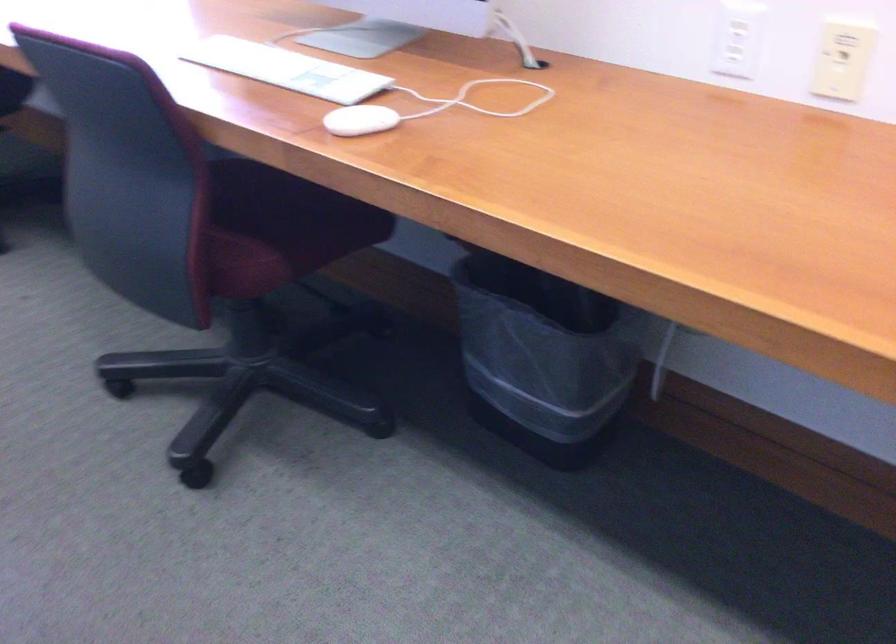
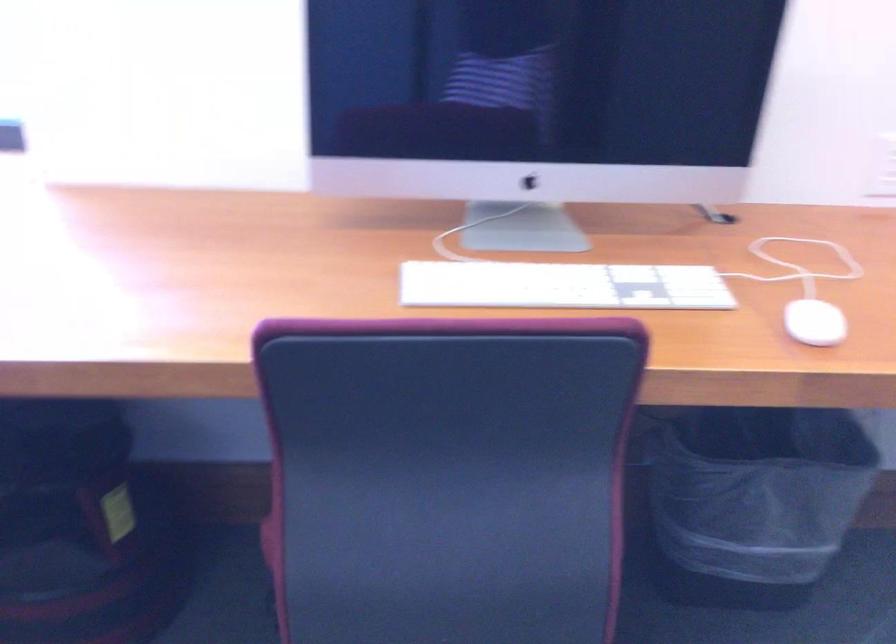
Locate, in the second image, the point that corresponds to point 346,120 in the first image.

(814, 323)